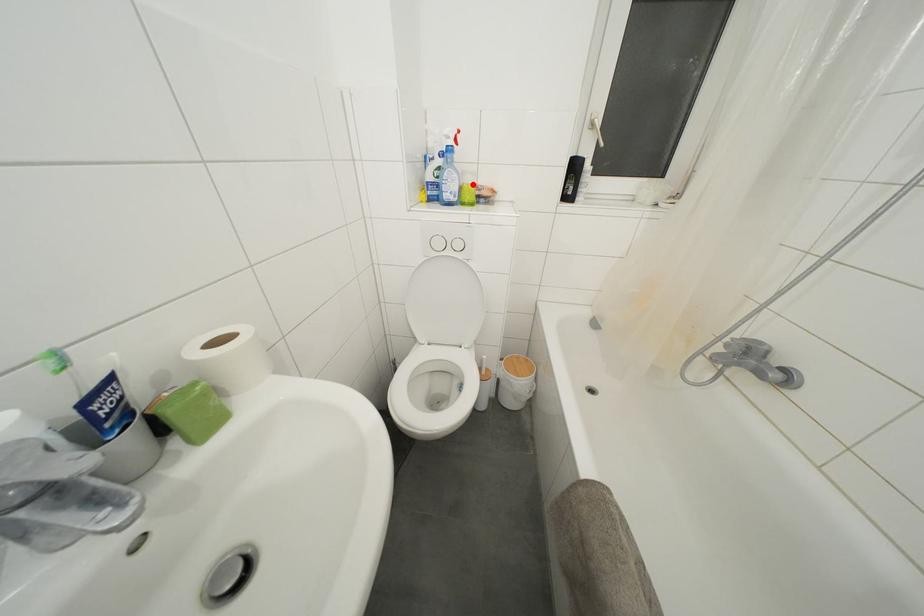
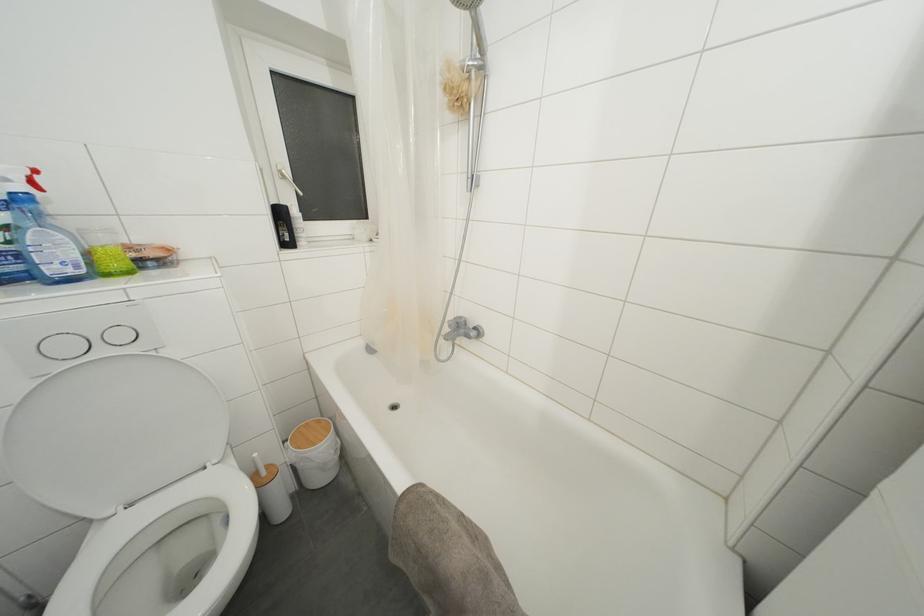
The point at the highlighted location is marked in the first image. Where is the corresponding point in the second image?

(108, 245)